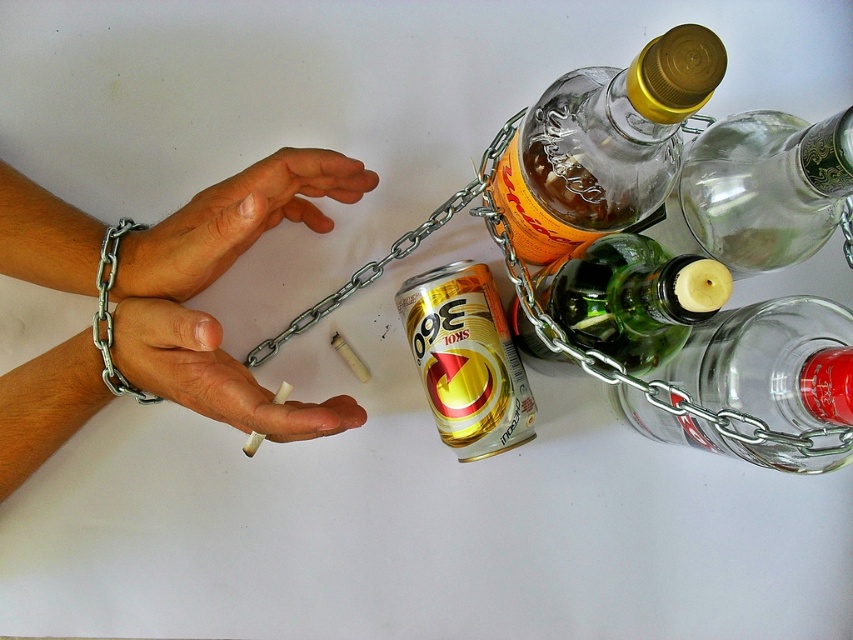
Question: Among these points, which one is farthest from the camera?

Choices:
 (A) (222, 234)
 (B) (107, 284)
 (C) (509, 388)
 (D) (173, 356)

Answer: (C)

Question: Is metal chain at left bigger than silver chain bracelet at left?

Choices:
 (A) yes
 (B) no

Answer: (A)

Question: Is the position of metal chain at left less distant than that of silver chain bracelet at left?

Choices:
 (A) no
 (B) yes

Answer: (B)

Question: Can you confirm if dry skin at left is smaller than white matte cigarette at center?

Choices:
 (A) yes
 (B) no

Answer: (B)

Question: Which object is positioned closest to the metal chain at left?

Choices:
 (A) gold metallic can at center
 (B) green glass bottle at lower right

Answer: (A)

Question: Estimate the real-world distances between objects in this image. Which object is closer to the white matte cigarette at center?

Choices:
 (A) gold metallic can at center
 (B) transparent glass bottle at upper right

Answer: (A)